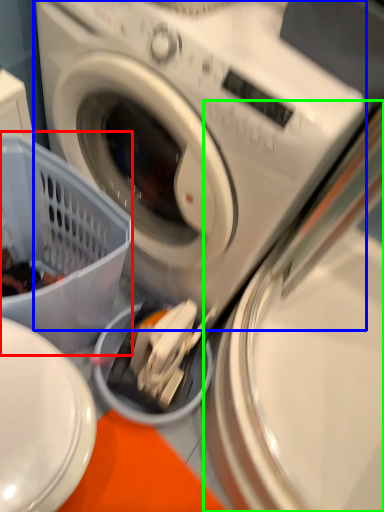
Question: Based on their relative distances, which object is nearer to basket (highlighted by a red box)? Choose from washing machine (highlighted by a blue box) and washing machine (highlighted by a green box).

Choices:
 (A) washing machine
 (B) washing machine

Answer: (A)